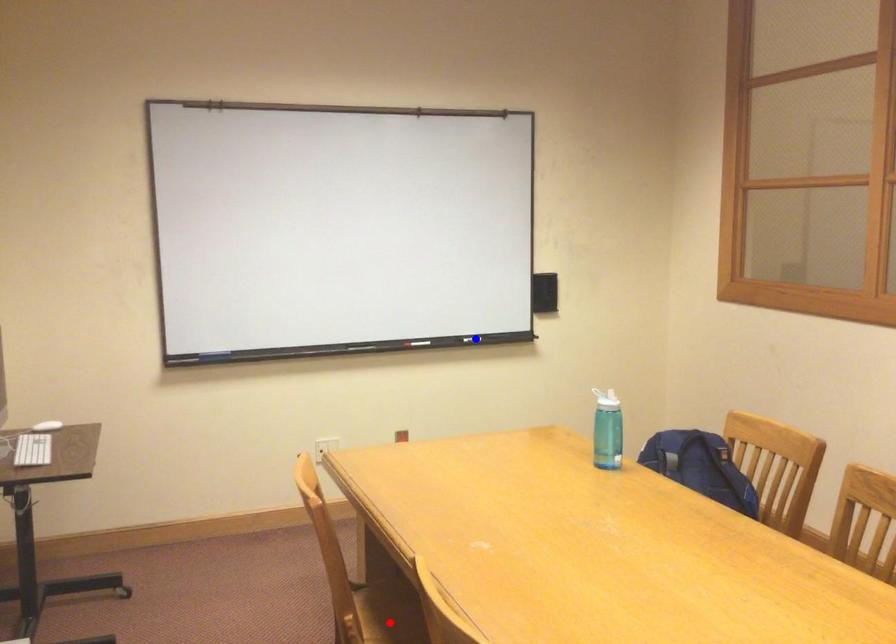
Question: Which of the two points in the image is closer to the camera?

Choices:
 (A) Blue point is closer.
 (B) Red point is closer.

Answer: (B)